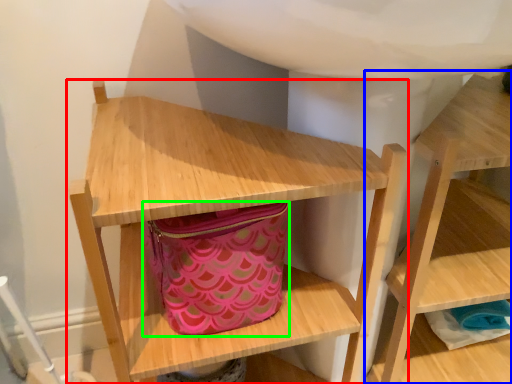
Question: Which object is the closest to the shelf (highlighted by a red box)? Choose among these: shelf (highlighted by a blue box) or bag (highlighted by a green box).

Choices:
 (A) shelf
 (B) bag

Answer: (B)